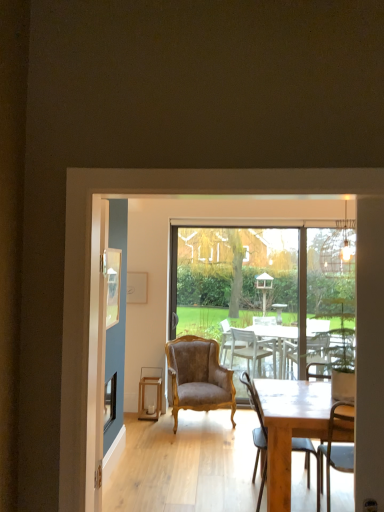
Question: Should I look upward or downward to see wooden picture frame at upper left?

Choices:
 (A) down
 (B) up

Answer: (A)

Question: Is wooden picture frame at upper left touching transparent glass window screen at center?

Choices:
 (A) no
 (B) yes

Answer: (A)

Question: Is wooden picture frame at upper left outside transparent glass window screen at center?

Choices:
 (A) yes
 (B) no

Answer: (A)

Question: From a real-world perspective, is wooden picture frame at upper left below transparent glass window screen at center?

Choices:
 (A) no
 (B) yes

Answer: (A)

Question: Considering the relative sizes of wooden picture frame at upper left and transparent glass window screen at center in the image provided, is wooden picture frame at upper left bigger than transparent glass window screen at center?

Choices:
 (A) no
 (B) yes

Answer: (A)

Question: Is wooden picture frame at upper left wider than transparent glass window screen at center?

Choices:
 (A) yes
 (B) no

Answer: (B)

Question: Does wooden picture frame at upper left have a smaller size compared to transparent glass window screen at center?

Choices:
 (A) no
 (B) yes

Answer: (B)

Question: From a real-world perspective, does transparent glass screen door at center stand above wooden table at center?

Choices:
 (A) yes
 (B) no

Answer: (A)

Question: Can you confirm if transparent glass screen door at center is bigger than wooden table at center?

Choices:
 (A) no
 (B) yes

Answer: (A)

Question: Considering the relative sizes of transparent glass screen door at center and wooden table at center in the image provided, is transparent glass screen door at center smaller than wooden table at center?

Choices:
 (A) no
 (B) yes

Answer: (B)

Question: From the image's perspective, is transparent glass screen door at center located beneath wooden table at center?

Choices:
 (A) yes
 (B) no

Answer: (B)

Question: Does transparent glass screen door at center have a greater width compared to wooden table at center?

Choices:
 (A) no
 (B) yes

Answer: (A)

Question: Considering the relative sizes of transparent glass screen door at center and wooden table at center in the image provided, is transparent glass screen door at center taller than wooden table at center?

Choices:
 (A) no
 (B) yes

Answer: (B)

Question: Would you say wooden stool at center is outside brown velvet armchair at center, the 1th chair viewed from the back?

Choices:
 (A) yes
 (B) no

Answer: (A)